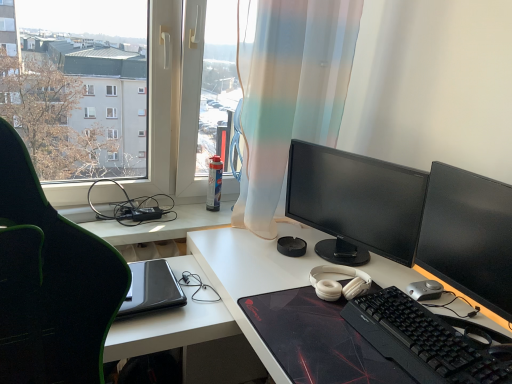
You are a GUI agent. You are given a task and a screenshot of the screen. Output one action in this format:
    pyautogui.click(x=<x>, y=<y>)
    Task: Click on the black matte keyboard at lower right
    The image size is (512, 384).
    Given the screenshot: What is the action you would take?
    pyautogui.click(x=422, y=341)

This screenshot has height=384, width=512. What do you see at coordinates (338, 282) in the screenshot?
I see `white matte headphones at center` at bounding box center [338, 282].

The image size is (512, 384). What do you see at coordinates (356, 197) in the screenshot?
I see `matte black monitor at center, the 1th computer monitor when ordered from back to front` at bounding box center [356, 197].

What do you see at coordinates (252, 274) in the screenshot? This screenshot has height=384, width=512. I see `black matte desk at center` at bounding box center [252, 274].

Where is `translucent fabric curtain at center`? Image resolution: width=512 pixels, height=384 pixels. translucent fabric curtain at center is located at coordinates (288, 93).

What is the approximate width of transparent plastic window at upper left?

6.01 inches.

This screenshot has width=512, height=384. I want to click on black matte keyboard at lower right, so click(x=422, y=341).

Is white matte headphones at center aimed at black matte keyboard at lower right?

Yes, white matte headphones at center is facing black matte keyboard at lower right.

Does white matte headphones at center have a smaller size compared to black matte keyboard at lower right?

Correct, white matte headphones at center occupies less space than black matte keyboard at lower right.

Considering the relative positions of white matte headphones at center and black matte keyboard at lower right in the image provided, is white matte headphones at center to the right of black matte keyboard at lower right from the viewer's perspective?

Incorrect, white matte headphones at center is not on the right side of black matte keyboard at lower right.

From a real-world perspective, which is physically above, white matte headphones at center or black matte keyboard at lower right?

white matte headphones at center is physically above.

What's the angular difference between black textured mousepad at center and black glossy monitor at right, arranged as the second computer monitor when viewed from the back,'s facing directions?

The facing directions of black textured mousepad at center and black glossy monitor at right, arranged as the second computer monitor when viewed from the back, are 0.178 degrees apart.

From a real-world perspective, starting from the black textured mousepad at center, which computer monitor is the 2nd one vertically above it? Please provide its 2D coordinates.

[(468, 236)]

Is black textured mousepad at center to the right of black glossy monitor at right, arranged as the second computer monitor when viewed from the back, from the viewer's perspective?

Incorrect, black textured mousepad at center is not on the right side of black glossy monitor at right, arranged as the second computer monitor when viewed from the back.

Is black textured mousepad at center far from black glossy monitor at right, arranged as the second computer monitor when viewed from the back?

black textured mousepad at center is near black glossy monitor at right, arranged as the second computer monitor when viewed from the back, not far away.

Would you say black matte keyboard at lower right is to the left or to the right of translucent fabric curtain at center in the picture?

black matte keyboard at lower right is to the right of translucent fabric curtain at center.

Based on the photo, is black matte keyboard at lower right located outside translucent fabric curtain at center?

black matte keyboard at lower right is positioned outside translucent fabric curtain at center.

From a real-world perspective, is black matte keyboard at lower right on translucent fabric curtain at center?

Actually, black matte keyboard at lower right is physically below translucent fabric curtain at center in the real world.

Between black matte keyboard at lower right and translucent fabric curtain at center, which one has smaller width?

black matte keyboard at lower right.

Which object is thinner, translucent fabric curtain at center or matte black monitor at center, positioned as the 2th computer monitor in front-to-back order?

Thinner between the two is matte black monitor at center, positioned as the 2th computer monitor in front-to-back order.

How far apart are translucent fabric curtain at center and matte black monitor at center, positioned as the 2th computer monitor in front-to-back order?

The distance of translucent fabric curtain at center from matte black monitor at center, positioned as the 2th computer monitor in front-to-back order, is 10.08 inches.

Is translucent fabric curtain at center not close to matte black monitor at center, positioned as the 2th computer monitor in front-to-back order?

They are positioned close to each other.

From the image's perspective, which computer monitor is the 1st one below the translucent fabric curtain at center? Please provide its 2D coordinates.

[(356, 197)]

Which object is wider, matte black monitor at center, the 1th computer monitor when ordered from back to front, or black matte desk at center?

black matte desk at center is wider.

Could you tell me if matte black monitor at center, the 1th computer monitor when ordered from back to front, is turned towards black matte desk at center?

No, matte black monitor at center, the 1th computer monitor when ordered from back to front, does not turn towards black matte desk at center.

From the image's perspective, is matte black monitor at center, positioned as the 2th computer monitor in front-to-back order, located above or below black matte desk at center?

matte black monitor at center, positioned as the 2th computer monitor in front-to-back order, is above black matte desk at center.

At what (x,y) coordinates should I click in order to perform the action: click on desk that is on the left side of matte black monitor at center, positioned as the 2th computer monitor in front-to-back order. Please return your answer as a coordinate pair (x, y). The height and width of the screenshot is (384, 512). Looking at the image, I should click on (252, 274).

Is black glossy monitor at right, arranged as the second computer monitor when viewed from the back, in front of or behind silver metallic mouse at lower right in the image?

Clearly, black glossy monitor at right, arranged as the second computer monitor when viewed from the back, is in front of silver metallic mouse at lower right.

Which is more to the right, black glossy monitor at right, arranged as the second computer monitor when viewed from the back, or silver metallic mouse at lower right?

black glossy monitor at right, arranged as the second computer monitor when viewed from the back.

From the image's perspective, starting from the silver metallic mouse at lower right, which computer monitor is the 1st one above? Please provide its 2D coordinates.

[(468, 236)]

From the image's perspective, relative to silver metallic mouse at lower right, is black glossy monitor at right, arranged as the second computer monitor when viewed from the back, above or below?

black glossy monitor at right, arranged as the second computer monitor when viewed from the back, is above silver metallic mouse at lower right.

Is transparent plastic window at upper left inside the boundaries of silver metallic mouse at lower right, or outside?

transparent plastic window at upper left exists outside the volume of silver metallic mouse at lower right.

Which is farther from the camera, (36, 154) or (419, 293)?

Positioned behind is point (36, 154).

Consider the image. Considering the positions of objects transparent plastic window at upper left and silver metallic mouse at lower right in the image provided, who is more to the right, transparent plastic window at upper left or silver metallic mouse at lower right?

silver metallic mouse at lower right is more to the right.

Based on the photo, considering the relative sizes of transparent plastic window at upper left and silver metallic mouse at lower right in the image provided, is transparent plastic window at upper left thinner than silver metallic mouse at lower right?

No, transparent plastic window at upper left is not thinner than silver metallic mouse at lower right.

Image resolution: width=512 pixels, height=384 pixels. In order to click on headphones lying above the black matte keyboard at lower right (from the image's perspective) in this screenshot , I will do tap(338, 282).

The height and width of the screenshot is (384, 512). In order to click on mousepad that is on the left side of black glossy monitor at right, arranged as the second computer monitor when viewed from the back in this screenshot , I will do `click(317, 340)`.

From the image, which object appears to be farther from matte black monitor at center, the 1th computer monitor when ordered from back to front, black glossy monitor at right, the first computer monitor from the front, or translucent fabric curtain at center?

translucent fabric curtain at center lies further to matte black monitor at center, the 1th computer monitor when ordered from back to front, than the other object.

Looking at this image, when comparing their distances from translucent fabric curtain at center, does matte black monitor at center, positioned as the 2th computer monitor in front-to-back order, or silver metallic mouse at lower right seem closer?

matte black monitor at center, positioned as the 2th computer monitor in front-to-back order, lies closer to translucent fabric curtain at center than the other object.

Looking at the image, which one is located further to matte black monitor at center, the 1th computer monitor when ordered from back to front, transparent plastic window at upper left or translucent fabric curtain at center?

transparent plastic window at upper left.

When comparing their distances from black matte keyboard at lower right, does silver metallic mouse at lower right or black glossy monitor at right, the first computer monitor from the front, seem closer?

black glossy monitor at right, the first computer monitor from the front, is positioned closer to the anchor black matte keyboard at lower right.

Looking at the image, which one is located closer to black textured mousepad at center, transparent plastic window at upper left or matte black monitor at center, positioned as the 2th computer monitor in front-to-back order?

The object closer to black textured mousepad at center is matte black monitor at center, positioned as the 2th computer monitor in front-to-back order.

Based on their spatial positions, is black glossy monitor at right, arranged as the second computer monitor when viewed from the back, or black matte desk at center further from translucent fabric curtain at center?

black glossy monitor at right, arranged as the second computer monitor when viewed from the back, is further to translucent fabric curtain at center.

Based on their spatial positions, is white matte headphones at center or black textured mousepad at center further from matte black monitor at center, the 1th computer monitor when ordered from back to front?

black textured mousepad at center lies further to matte black monitor at center, the 1th computer monitor when ordered from back to front, than the other object.

Considering their positions, is transparent plastic window at upper left positioned closer to white matte headphones at center than matte black monitor at center, positioned as the 2th computer monitor in front-to-back order?

The object closer to white matte headphones at center is matte black monitor at center, positioned as the 2th computer monitor in front-to-back order.

Identify the location of mouse that lies between transparent plastic window at upper left and black matte desk at center from top to bottom. The image size is (512, 384). (425, 290).

Find the location of a particular element. computer monitor between translucent fabric curtain at center and black glossy monitor at right, the first computer monitor from the front, in the horizontal direction is located at coordinates (356, 197).

Locate an element on the screen. mouse that lies between matte black monitor at center, positioned as the 2th computer monitor in front-to-back order, and black matte desk at center from top to bottom is located at coordinates (425, 290).

Identify the location of headphones between transparent plastic window at upper left and black glossy monitor at right, arranged as the second computer monitor when viewed from the back. This screenshot has height=384, width=512. click(x=338, y=282).